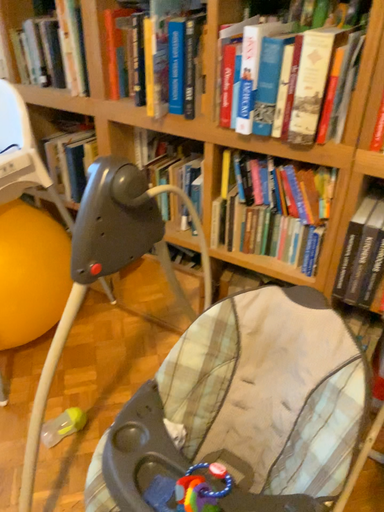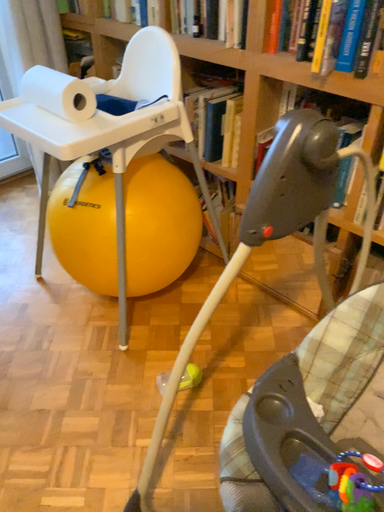
Question: How did the camera likely rotate when shooting the video?

Choices:
 (A) rotated right
 (B) rotated left

Answer: (B)